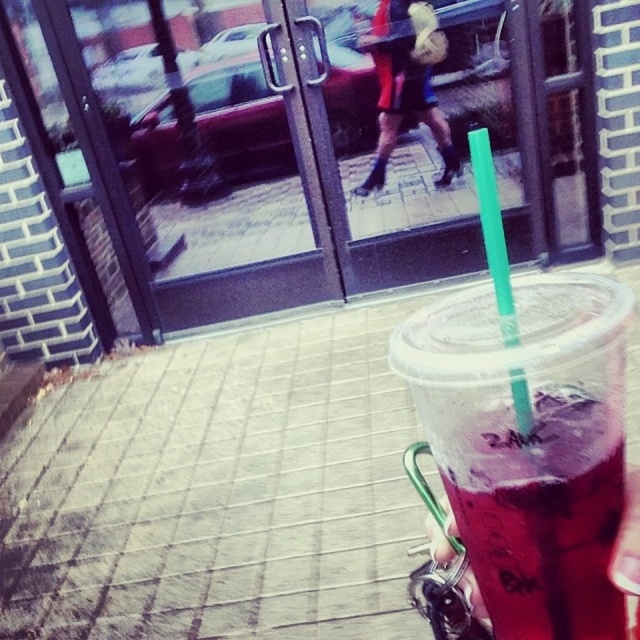
Question: Which point appears closest to the camera in this image?

Choices:
 (A) (486, 220)
 (B) (625, 547)

Answer: (B)

Question: Which point is closer to the camera?

Choices:
 (A) click(524, 397)
 (B) click(621, 541)

Answer: (A)

Question: Can you confirm if green plastic straw at center is positioned to the left of purple translucent cup at lower right?

Choices:
 (A) yes
 (B) no

Answer: (A)

Question: Is green plastic straw at center smaller than purple translucent cup at lower right?

Choices:
 (A) no
 (B) yes

Answer: (A)

Question: Among these points, which one is farthest from the camera?

Choices:
 (A) (621, 584)
 (B) (490, 234)

Answer: (B)

Question: Does green plastic straw at center appear on the right side of purple translucent cup at lower right?

Choices:
 (A) no
 (B) yes

Answer: (A)